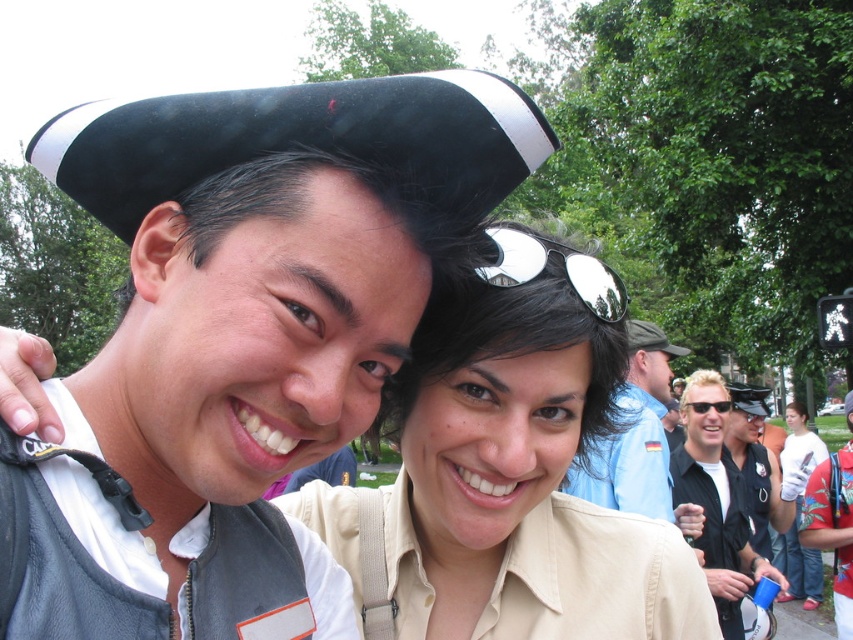
Can you confirm if light brown hair at center is positioned above dark gray fabric cap at upper center?

Yes, light brown hair at center is above dark gray fabric cap at upper center.

Who is positioned more to the right, light brown hair at center or dark gray fabric cap at upper center?

dark gray fabric cap at upper center

Is point (709, 387) more distant than point (846, 412)?

No, (709, 387) is closer to viewer.

The image size is (853, 640). Identify the location of light brown hair at center. (704, 413).

Which is behind, point (440, 509) or point (703, 452)?

The point (703, 452) is more distant.

Describe the element at coordinates (514, 336) in the screenshot. The width and height of the screenshot is (853, 640). I see `matte beige shirt at center` at that location.

This screenshot has width=853, height=640. Find the location of `matte beige shirt at center`. matte beige shirt at center is located at coordinates (514, 336).

Is matte khaki shirt at center positioned in front of light brown hair at center?

Yes, it is.

Which is in front, point (695, 566) or point (706, 387)?

Point (695, 566) is more forward.

I want to click on matte khaki shirt at center, so [x=508, y=483].